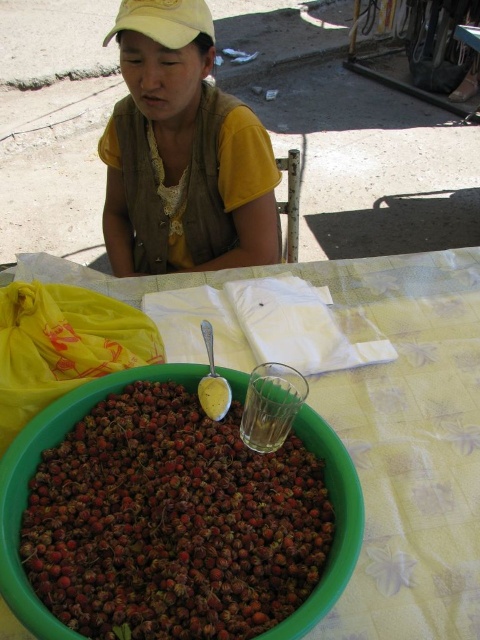
Which of these two, yellow fabric at center or yellow cotton shirt at upper center, stands taller?

Standing taller between the two is yellow cotton shirt at upper center.

Can you confirm if yellow fabric at center is positioned below yellow cotton shirt at upper center?

Indeed, yellow fabric at center is positioned under yellow cotton shirt at upper center.

Is point (372, 314) closer to viewer compared to point (215, 246)?

That is True.

Image resolution: width=480 pixels, height=640 pixels. Find the location of `yellow fabric at center`. yellow fabric at center is located at coordinates (385, 428).

Does red matte berries at center appear on the left side of yellow cotton shirt at upper center?

In fact, red matte berries at center is to the right of yellow cotton shirt at upper center.

Based on the photo, does red matte berries at center have a greater height compared to yellow cotton shirt at upper center?

No, red matte berries at center is not taller than yellow cotton shirt at upper center.

Which is in front, point (170, 385) or point (172, 88)?

Point (170, 385) is in front.

Locate an element on the screen. This screenshot has height=640, width=480. red matte berries at center is located at coordinates (172, 522).

Can you confirm if red matte berries at center is positioned to the right of yellow fabric at center?

In fact, red matte berries at center is to the left of yellow fabric at center.

Locate an element on the screen. The image size is (480, 640). red matte berries at center is located at coordinates (172, 522).

Image resolution: width=480 pixels, height=640 pixels. Find the location of `red matte berries at center`. red matte berries at center is located at coordinates pyautogui.click(x=172, y=522).